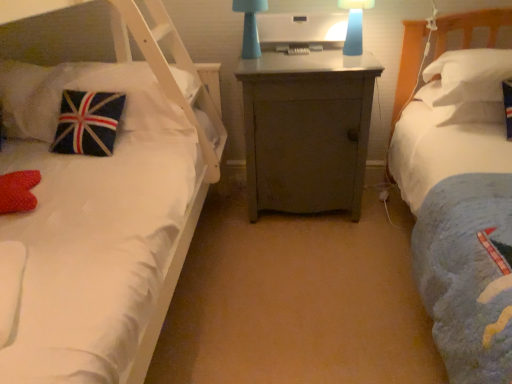
Question: In which direction should I rotate to look at matte blue lamp at center, placed as the 1th bedside lamp when sorted from left to right?

Choices:
 (A) right
 (B) left

Answer: (B)

Question: Considering the relative sizes of velvet union jack pillow at left, positioned as the 3th pillow in right-to-left order, and matte blue lamp at center, the second bedside lamp when ordered from right to left, in the image provided, is velvet union jack pillow at left, positioned as the 3th pillow in right-to-left order, thinner than matte blue lamp at center, the second bedside lamp when ordered from right to left,?

Choices:
 (A) no
 (B) yes

Answer: (A)

Question: Considering the relative positions of velvet union jack pillow at left, positioned as the 3th pillow in right-to-left order, and matte blue lamp at center, the second bedside lamp when ordered from right to left, in the image provided, is velvet union jack pillow at left, positioned as the 3th pillow in right-to-left order, to the left of matte blue lamp at center, the second bedside lamp when ordered from right to left, from the viewer's perspective?

Choices:
 (A) no
 (B) yes

Answer: (B)

Question: Considering the relative sizes of velvet union jack pillow at left, which is counted as the 1th pillow, starting from the left, and matte blue lamp at center, placed as the 1th bedside lamp when sorted from left to right, in the image provided, is velvet union jack pillow at left, which is counted as the 1th pillow, starting from the left, bigger than matte blue lamp at center, placed as the 1th bedside lamp when sorted from left to right,?

Choices:
 (A) no
 (B) yes

Answer: (B)

Question: Is velvet union jack pillow at left, positioned as the 3th pillow in right-to-left order, further to the viewer compared to matte blue lamp at center, the second bedside lamp when ordered from right to left?

Choices:
 (A) yes
 (B) no

Answer: (B)

Question: Is velvet union jack pillow at left, positioned as the 3th pillow in right-to-left order, positioned in front of matte blue lamp at center, the second bedside lamp when ordered from right to left?

Choices:
 (A) no
 (B) yes

Answer: (B)

Question: Is velvet union jack pillow at left, positioned as the 3th pillow in right-to-left order, to the right of matte blue lamp at center, placed as the 1th bedside lamp when sorted from left to right, from the viewer's perspective?

Choices:
 (A) no
 (B) yes

Answer: (A)

Question: Is matte blue lamp at center, placed as the 1th bedside lamp when sorted from left to right, closer to the viewer compared to white soft pillow at right, the third pillow when ordered from left to right?

Choices:
 (A) yes
 (B) no

Answer: (B)

Question: Does matte blue lamp at center, the second bedside lamp when ordered from right to left, appear on the right side of white soft pillow at right, the third pillow when ordered from left to right?

Choices:
 (A) no
 (B) yes

Answer: (A)

Question: From a real-world perspective, is matte blue lamp at center, placed as the 1th bedside lamp when sorted from left to right, on top of white soft pillow at right, positioned as the first pillow in right-to-left order?

Choices:
 (A) yes
 (B) no

Answer: (A)

Question: Is matte blue lamp at center, placed as the 1th bedside lamp when sorted from left to right, to the left of white soft pillow at right, positioned as the first pillow in right-to-left order, from the viewer's perspective?

Choices:
 (A) yes
 (B) no

Answer: (A)

Question: Is matte blue lamp at center, placed as the 1th bedside lamp when sorted from left to right, facing away from white soft pillow at right, positioned as the first pillow in right-to-left order?

Choices:
 (A) no
 (B) yes

Answer: (A)

Question: Is matte blue lamp at center, placed as the 1th bedside lamp when sorted from left to right, outside of white soft pillow at right, positioned as the first pillow in right-to-left order?

Choices:
 (A) no
 (B) yes

Answer: (B)

Question: From the image's perspective, is white soft pillow at right, the third pillow when ordered from left to right, on blue matte lampshade at upper center, which is counted as the first bedside lamp, starting from the right?

Choices:
 (A) yes
 (B) no

Answer: (B)